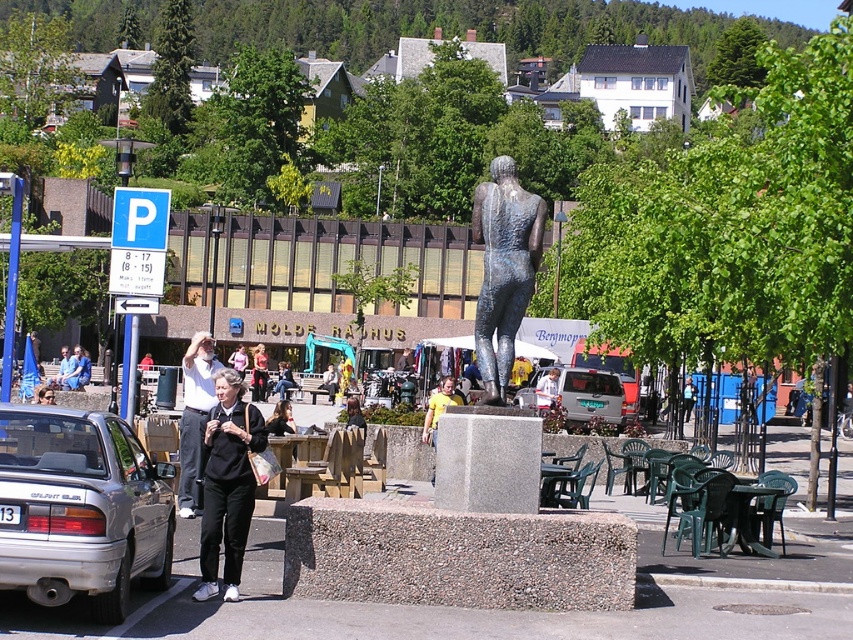
You are a fashion designer attending a street art festival and notice a matte black dress at center displayed on a mannequin. You want to take a photo of the dress but also include the statue of a person standing upright on a textured stone pedestal in the background. Given their positions, will the statue be fully visible in the photo if you frame the dress at the center?

The matte black dress at center is located at point (259, 372). Since the statue is positioned at the focal point and the dress is centered, the statue should be visible in the background when framing the dress, but its exact visibility depends on the camera angle and zoom. However, based on the coordinates, the dress is slightly offset, allowing the statue to remain in the frame.

You are a delivery person who needs to deliver a package to the matte black dress at center. You have a matte silver van at center that is 10 feet long. Is there enough space for the van to maneuver around the statue and reach the dress without hitting anything?

The matte silver van at center is 61.84 feet away from the matte black dress at center. Since the van is only 10 feet long, there is sufficient space for it to maneuver around the statue and reach the dress without any obstructions.

You are a delivery person needing to load a large package into your vehicle. You see the matte silver van at center and the matte black dress at center in the scene. Which vehicle can you use to carry the large package?

The matte silver van at center has a larger size compared to the matte black dress at center, so the matte silver van at center is the appropriate vehicle for carrying the large package.